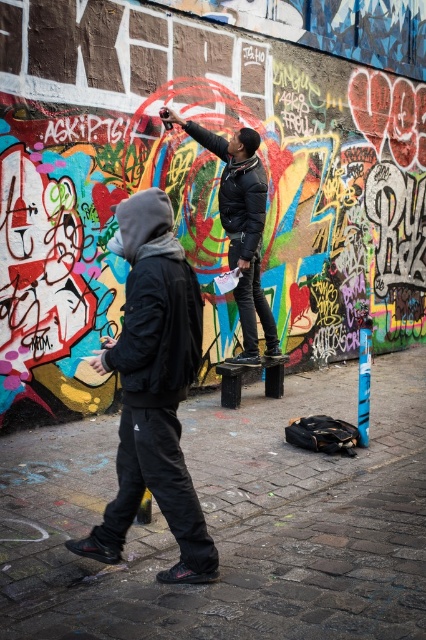
You are a photographer standing at the scene. You want to take a photo of the dark gray hoodie at left and the black leather jacket at center. The minimum distance between them is 3.29 meters. If your camera has a focal length of 50mm and you want both subjects to be in focus, what is the hyperfocal distance required to ensure both are sharp?

The hyperfocal distance required would be calculated based on the distance between the dark gray hoodie at left and the black leather jacket at center, which is 3.29 meters. However, without specific aperture and sensor size details, an exact calculation isn not possible. Generally, setting a small aperture like f16 and focusing around 2 meters might work, but precise calculation needs more parameters.

You are standing on the street looking at the graffiti wall. There are two points marked on the wall at coordinates point [198,321] and point [255,220]. Which point is closer to you?

Point [198,321] is closer to the viewer than point [255,220].